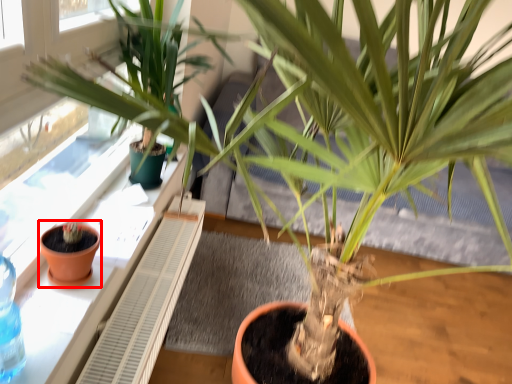
Question: Where is flowerpot (annotated by the red box) located in relation to window sill in the image?

Choices:
 (A) right
 (B) left

Answer: (A)